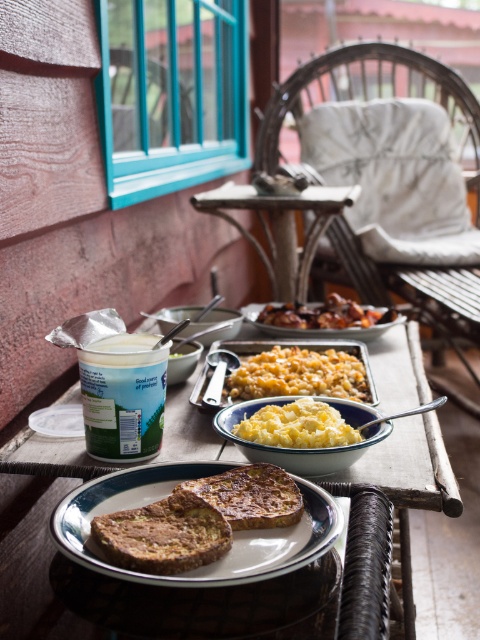
Is point (324, 364) positioned after point (272, 308)?

No, it is not.

Is yellowish matte cornbread at center positioned before golden crispy fried chicken at center?

Yes, yellowish matte cornbread at center is in front of golden crispy fried chicken at center.

Does point (304, 378) lie in front of point (330, 312)?

Yes, point (304, 378) is in front of point (330, 312).

This screenshot has height=640, width=480. Find the location of `yellowish matte cornbread at center`. yellowish matte cornbread at center is located at coordinates (299, 374).

Who is positioned more to the right, green matte yogurt at center or golden crispy fried chicken at center?

Positioned to the right is golden crispy fried chicken at center.

Is point (120, 401) positioned in front of point (344, 308)?

That is True.

Who is more distant from viewer, (x=127, y=403) or (x=392, y=321)?

Positioned behind is point (x=392, y=321).

Locate an element on the screen. This screenshot has width=480, height=640. green matte yogurt at center is located at coordinates (122, 396).

Between point (43, 637) and point (346, 308), which one is positioned in front?

Point (43, 637) is in front.

Describe the element at coordinates (36, 532) in the screenshot. Image resolution: width=480 pixels, height=640 pixels. I see `white wood picnic table at center` at that location.

Looking at this image, who is more distant from viewer, (365, 483) or (257, 317)?

Point (257, 317)

Where is `white wood picnic table at center`? This screenshot has height=640, width=480. white wood picnic table at center is located at coordinates (36, 532).